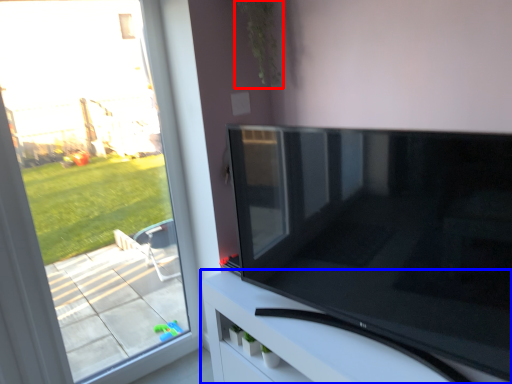
Question: Which of the following is the closest to the observer, plant (highlighted by a red box) or furniture (highlighted by a blue box)?

Choices:
 (A) plant
 (B) furniture

Answer: (B)